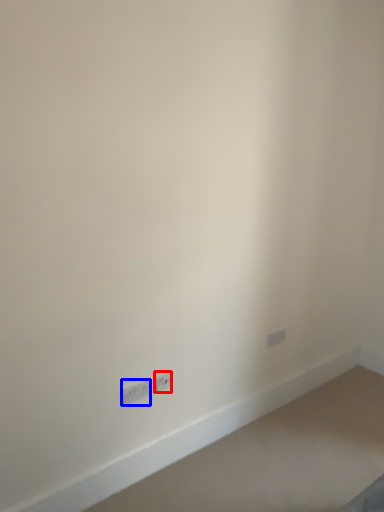
Question: Among these objects, which one is nearest to the camera, power plugs and sockets (highlighted by a red box) or power plugs and sockets (highlighted by a blue box)?

Choices:
 (A) power plugs and sockets
 (B) power plugs and sockets

Answer: (B)